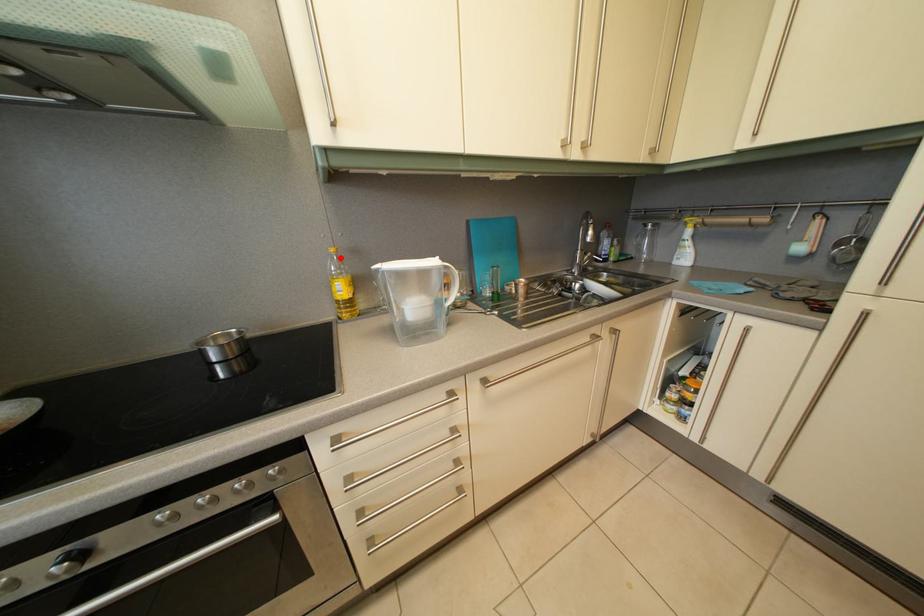
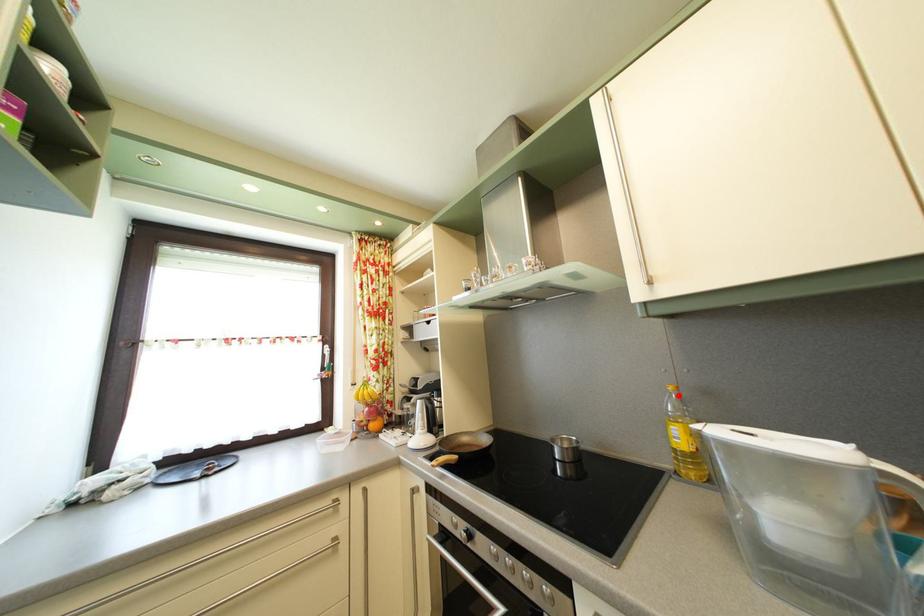
I am providing you with two images of the same scene from different viewpoints. A red point is marked on the first image and another point is marked on the second image. Do the highlighted points in image1 and image2 indicate the same real-world spot?

Yes